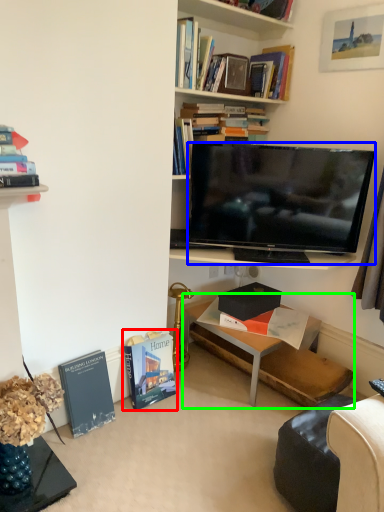
Question: Which object is positioned closest to book (highlighted by a red box)? Select from television (highlighted by a blue box) and table (highlighted by a green box).

Choices:
 (A) television
 (B) table

Answer: (B)